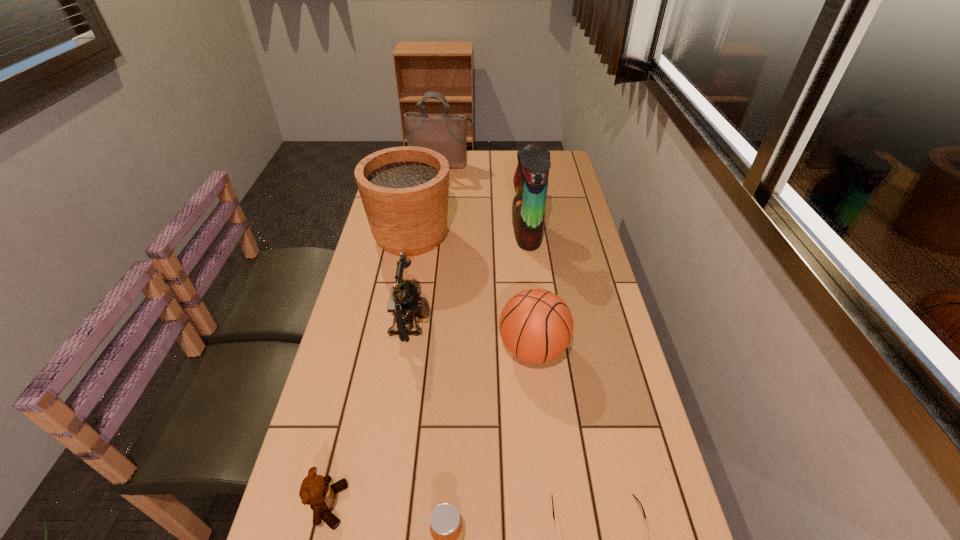
At what (x,y) coordinates should I click in order to perform the action: click on object that is at the far left corner. Please return your answer as a coordinate pair (x, y). Looking at the image, I should click on (445, 134).

The height and width of the screenshot is (540, 960). Find the location of `free space at the far edge of the desktop`. free space at the far edge of the desktop is located at coordinates (514, 152).

Where is `vacant space at the left edge`? This screenshot has height=540, width=960. vacant space at the left edge is located at coordinates (349, 323).

Identify the location of vacant area at the right edge of the desktop. This screenshot has width=960, height=540. pyautogui.click(x=556, y=213).

The image size is (960, 540). I want to click on vacant space that is in between the shoulder bag and the teddy bear, so click(385, 335).

I want to click on unoccupied position between the basketball and the teddy bear, so click(x=431, y=427).

I want to click on vacant space in between the farthest object and the teddy bear, so click(x=385, y=335).

Image resolution: width=960 pixels, height=540 pixels. In order to click on vacant space that's between the third tallest object and the teddy bear in this screenshot , I will do (370, 370).

The height and width of the screenshot is (540, 960). I want to click on free space between the flowerpot and the parrot, so click(x=468, y=234).

The image size is (960, 540). Find the location of `object that is the fifth closest one to the teddy bear`. object that is the fifth closest one to the teddy bear is located at coordinates (404, 190).